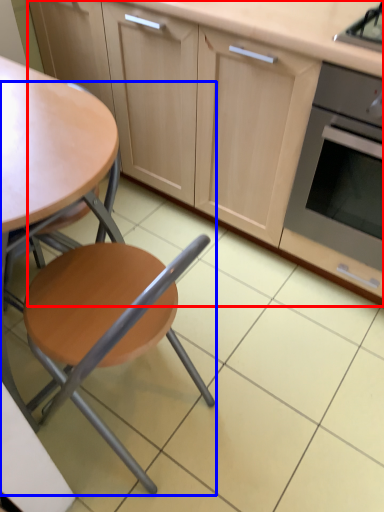
Question: Which of the following is the farthest to the observer, cabinetry (highlighted by a red box) or chair (highlighted by a blue box)?

Choices:
 (A) cabinetry
 (B) chair

Answer: (A)